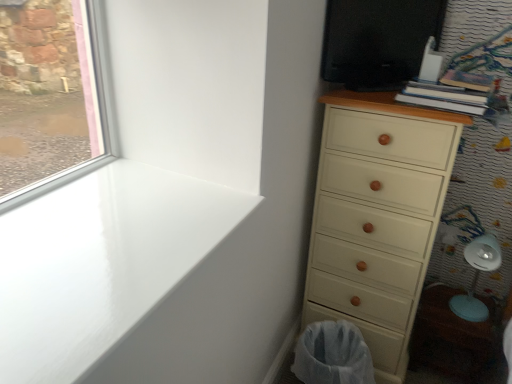
Question: Is white glossy window sill at upper left behind black glossy screen door at upper right?

Choices:
 (A) no
 (B) yes

Answer: (A)

Question: Is the depth of white glossy window sill at upper left less than that of black glossy screen door at upper right?

Choices:
 (A) no
 (B) yes

Answer: (B)

Question: Is white glossy window sill at upper left bigger than black glossy screen door at upper right?

Choices:
 (A) yes
 (B) no

Answer: (B)

Question: From the image's perspective, is white glossy window sill at upper left on top of black glossy screen door at upper right?

Choices:
 (A) no
 (B) yes

Answer: (A)

Question: From a real-world perspective, is white glossy window sill at upper left below black glossy screen door at upper right?

Choices:
 (A) yes
 (B) no

Answer: (A)

Question: In the image, is white glossy window sill at upper left on the left side or the right side of white mesh laundry basket at lower right?

Choices:
 (A) right
 (B) left

Answer: (B)

Question: Relative to white mesh laundry basket at lower right, is white glossy window sill at upper left in front or behind?

Choices:
 (A) behind
 (B) front

Answer: (B)

Question: Is white glossy window sill at upper left inside the boundaries of white mesh laundry basket at lower right, or outside?

Choices:
 (A) outside
 (B) inside

Answer: (A)

Question: From a real-world perspective, relative to white mesh laundry basket at lower right, is white glossy window sill at upper left vertically above or below?

Choices:
 (A) below
 (B) above

Answer: (B)

Question: Considering their positions, is white mesh laundry basket at lower right located in front of or behind white plastic swivel chair at lower right?

Choices:
 (A) behind
 (B) front

Answer: (B)

Question: In terms of height, does white mesh laundry basket at lower right look taller or shorter compared to white plastic swivel chair at lower right?

Choices:
 (A) tall
 (B) short

Answer: (B)

Question: From the image's perspective, is white mesh laundry basket at lower right located above or below white plastic swivel chair at lower right?

Choices:
 (A) above
 (B) below

Answer: (B)

Question: Is point pyautogui.click(x=320, y=347) closer or farther from the camera than point pyautogui.click(x=481, y=243)?

Choices:
 (A) closer
 (B) farther

Answer: (A)

Question: Considering their positions, is black glossy screen door at upper right located in front of or behind cream matte chest of drawers at right?

Choices:
 (A) front
 (B) behind

Answer: (B)

Question: Is black glossy screen door at upper right bigger or smaller than cream matte chest of drawers at right?

Choices:
 (A) big
 (B) small

Answer: (B)